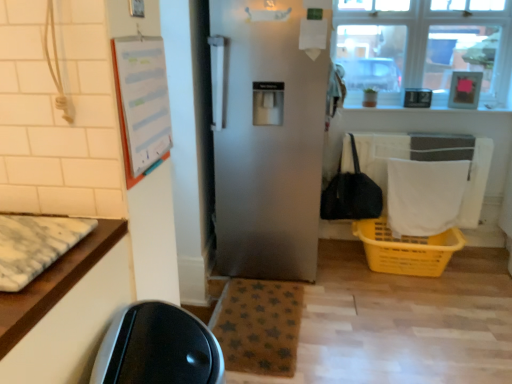
Question: Should I look upward or downward to see black fabric handbag at right?

Choices:
 (A) up
 (B) down

Answer: (A)

Question: Which direction should I rotate to face brown star-patterned mat at lower center, the 1th mat when ordered from back to front, — up or down?

Choices:
 (A) down
 (B) up

Answer: (A)

Question: Is clear glass window at upper right in front of white fabric laundry at lower right?

Choices:
 (A) yes
 (B) no

Answer: (B)

Question: Is white fabric laundry at lower right completely or partially inside clear glass window at upper right?

Choices:
 (A) no
 (B) yes

Answer: (A)

Question: Is clear glass window at upper right at the right side of white fabric laundry at lower right?

Choices:
 (A) no
 (B) yes

Answer: (B)

Question: Can you confirm if clear glass window at upper right is thinner than white fabric laundry at lower right?

Choices:
 (A) yes
 (B) no

Answer: (B)

Question: Is clear glass window at upper right completely or partially outside of white fabric laundry at lower right?

Choices:
 (A) yes
 (B) no

Answer: (A)

Question: Is clear glass window at upper right taller than white fabric laundry at lower right?

Choices:
 (A) yes
 (B) no

Answer: (A)

Question: Is brown star-patterned mat at lower center, the 1th mat when ordered from back to front, to the left of satin silver refrigerator at center from the viewer's perspective?

Choices:
 (A) no
 (B) yes

Answer: (B)

Question: Is brown star-patterned mat at lower center, the 1th mat when ordered from back to front, bigger than satin silver refrigerator at center?

Choices:
 (A) no
 (B) yes

Answer: (A)

Question: Is brown star-patterned mat at lower center, positioned as the second mat in top-to-bottom order, not close to satin silver refrigerator at center?

Choices:
 (A) yes
 (B) no

Answer: (B)

Question: From the image's perspective, is brown star-patterned mat at lower center, which ranks as the first mat in bottom-to-top order, under satin silver refrigerator at center?

Choices:
 (A) no
 (B) yes

Answer: (B)

Question: Is brown star-patterned mat at lower center, the 1th mat when ordered from back to front, at the right side of satin silver refrigerator at center?

Choices:
 (A) no
 (B) yes

Answer: (A)

Question: Is brown star-patterned mat at lower center, positioned as the second mat in top-to-bottom order, further to the viewer compared to satin silver refrigerator at center?

Choices:
 (A) no
 (B) yes

Answer: (A)

Question: Does white marble mat at left, arranged as the 1th mat when viewed from the top, touch white fabric laundry at lower right?

Choices:
 (A) yes
 (B) no

Answer: (B)